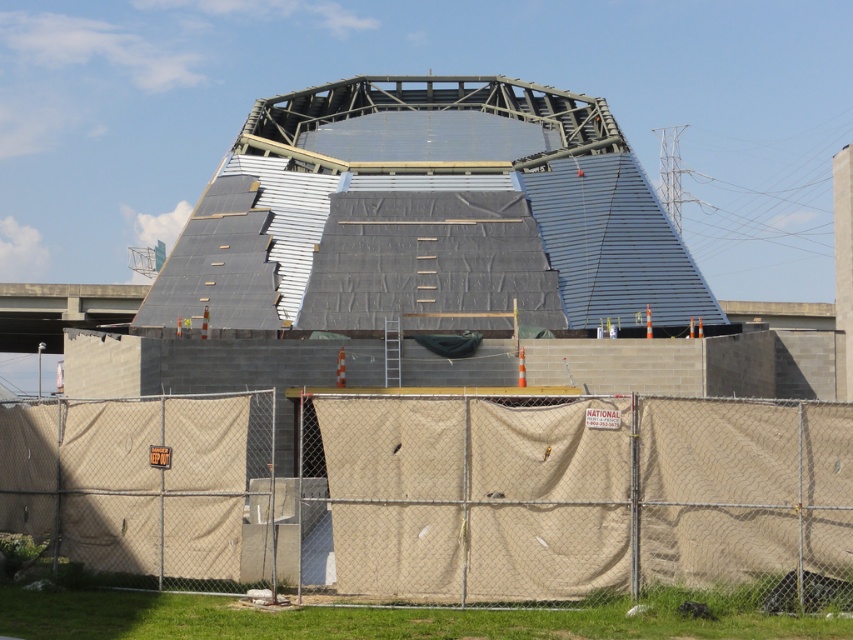
You are standing at the construction site and want to reach the point at coordinates point (688, 481). The safety regulations state that you must stay at least 20 meters away from any active construction areas. Is the point within the restricted area based on your current position?

The point (688, 481) is 16.41 meters from viewer, which is less than the required 20 meters. Therefore, the point is within the restricted area, and you should not approach it.

You are a safety inspector evaluating the construction site. You notice the beige fabric fence at lower center and the concrete bridge at left. According to safety regulations, the fence must be at least as tall as the bridge. Is the current fence height compliant with the regulation?

The beige fabric fence at lower center has a lesser height compared to the concrete bridge at left. Therefore, the fence does not meet the required height and is noncompliant with the safety regulations.

A construction worker needs to place a 50 feet long safety net between the beige fabric fence at lower center and another structure. Is the safety net long enough?

The distance between the beige fabric fence at lower center and the other structure is 54.00 feet. Since the safety net is only 50 feet long, it is not long enough to cover the entire gap.